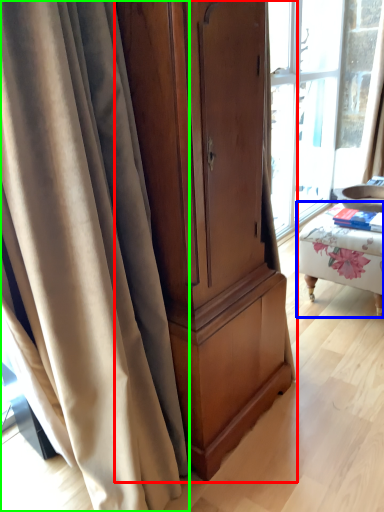
Question: Which object is the farthest from cabinetry (highlighted by a red box)? Choose among these: furniture (highlighted by a blue box) or curtain (highlighted by a green box).

Choices:
 (A) furniture
 (B) curtain

Answer: (A)